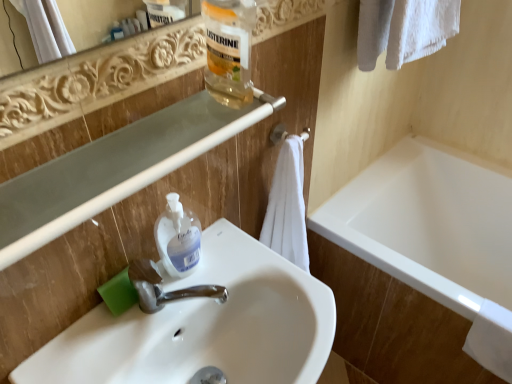
What is the approximate width of translucent plastic hand soap at sink?

translucent plastic hand soap at sink is 2.25 inches wide.

In order to face white soft towel at center, should I rotate leftwards or rightwards?

A 5.108 degree turn to the right will do.

The width and height of the screenshot is (512, 384). What do you see at coordinates (287, 206) in the screenshot?
I see `white soft towel at center` at bounding box center [287, 206].

The width and height of the screenshot is (512, 384). I want to click on clear plastic balustrade at upper center, so click(115, 169).

I want to click on translucent plastic hand soap at sink, so click(x=178, y=238).

Is clear plastic balustrade at upper center shorter than translucent plastic hand soap at sink?

Yes.

Which object is closer to the camera, clear plastic balustrade at upper center or translucent plastic hand soap at sink?

clear plastic balustrade at upper center is more forward.

Which point is more distant from viewer, (145, 157) or (186, 214)?

Point (186, 214)

Is clear plastic balustrade at upper center not within translucent plastic hand soap at sink?

Yes, clear plastic balustrade at upper center is not within translucent plastic hand soap at sink.

From a real-world perspective, which is physically below, white glossy bathtub at lower right or white soft towel at center?

white glossy bathtub at lower right is physically lower.

From the picture: Considering the relative positions of white glossy bathtub at lower right and white soft towel at center in the image provided, is white glossy bathtub at lower right to the left or to the right of white soft towel at center?

In the image, white glossy bathtub at lower right appears on the right side of white soft towel at center.

Who is smaller, white glossy bathtub at lower right or white soft towel at center?

Smaller between the two is white soft towel at center.

Considering the sizes of objects white glossy bathtub at lower right and white soft towel at center in the image provided, who is wider, white glossy bathtub at lower right or white soft towel at center?

white glossy bathtub at lower right.

From the image's perspective, is white soft towel at center below white glossy sink at center?

Actually, white soft towel at center appears above white glossy sink at center in the image.

Between white soft towel at center and white glossy sink at center, which one appears on the right side from the viewer's perspective?

white soft towel at center is more to the right.

Is white soft towel at center beside white glossy sink at center?

No, white soft towel at center is not touching white glossy sink at center.

Does point (168, 262) come behind point (236, 74)?

Yes, it is.

Consider the image. Is translucent plastic hand soap at sink in contact with translucent plastic bottle at upper center?

No, translucent plastic hand soap at sink is not beside translucent plastic bottle at upper center.

Is translucent plastic hand soap at sink smaller than translucent plastic bottle at upper center?

Correct, translucent plastic hand soap at sink occupies less space than translucent plastic bottle at upper center.

You are a GUI agent. You are given a task and a screenshot of the screen. Output one action in this format:
    pyautogui.click(x=<x>, y=<y>)
    Task: Click on the bottle located in front of the translucent plastic hand soap at sink
    The height and width of the screenshot is (384, 512).
    Given the screenshot: What is the action you would take?
    pyautogui.click(x=229, y=50)

Looking at this image, what's the angular difference between white glossy sink at center and translucent plastic bottle at upper center's facing directions?

They differ by 90.4 degrees in their facing directions.

Considering the sizes of white glossy sink at center and translucent plastic bottle at upper center in the image, is white glossy sink at center wider or thinner than translucent plastic bottle at upper center?

In the image, white glossy sink at center appears to be wider than translucent plastic bottle at upper center.

From a real-world perspective, between white glossy sink at center and translucent plastic bottle at upper center, who is vertically higher?

translucent plastic bottle at upper center.

Are white glossy sink at center and translucent plastic bottle at upper center located far from each other?

white glossy sink at center is near translucent plastic bottle at upper center, not far away.

Consider the image. Is clear plastic balustrade at upper center inside translucent plastic bottle at upper center?

That's incorrect, clear plastic balustrade at upper center is not inside translucent plastic bottle at upper center.

Between translucent plastic bottle at upper center and clear plastic balustrade at upper center, which one appears on the left side from the viewer's perspective?

From the viewer's perspective, clear plastic balustrade at upper center appears more on the left side.

From their relative heights in the image, would you say translucent plastic bottle at upper center is taller or shorter than clear plastic balustrade at upper center?

translucent plastic bottle at upper center is taller than clear plastic balustrade at upper center.

Measure the distance between translucent plastic bottle at upper center and clear plastic balustrade at upper center.

The distance of translucent plastic bottle at upper center from clear plastic balustrade at upper center is 6.16 inches.

Between white glossy sink at center and white glossy bathtub at lower right, which one appears on the left side from the viewer's perspective?

From the viewer's perspective, white glossy sink at center appears more on the left side.

Which of these two, white glossy sink at center or white glossy bathtub at lower right, stands taller?

Standing taller between the two is white glossy bathtub at lower right.

Would you say white glossy bathtub at lower right is part of white glossy sink at center's contents?

That's incorrect, white glossy bathtub at lower right is not inside white glossy sink at center.

Where is `cleaning product below the clear plastic balustrade at upper center (from the image's perspective)`? The image size is (512, 384). cleaning product below the clear plastic balustrade at upper center (from the image's perspective) is located at coordinates (178, 238).

Find the location of `bathtub that is on the right side of white soft towel at center`. bathtub that is on the right side of white soft towel at center is located at coordinates (435, 235).

Based on their spatial positions, is white glossy bathtub at lower right or white matte towel bar at center closer to translucent plastic bottle at upper center?

Based on the image, white matte towel bar at center appears to be nearer to translucent plastic bottle at upper center.

Looking at the image, which one is located further to translucent plastic bottle at upper center, white glossy bathtub at lower right or white glossy sink at center?

white glossy bathtub at lower right is positioned further to the anchor translucent plastic bottle at upper center.

Which object lies nearer to the anchor point white matte towel bar at center, white glossy bathtub at lower right or translucent plastic hand soap at sink?

translucent plastic hand soap at sink lies closer to white matte towel bar at center than the other object.

Considering their positions, is white matte towel bar at center positioned closer to translucent plastic hand soap at sink than translucent plastic bottle at upper center?

Answer: translucent plastic bottle at upper center.

When comparing their distances from clear plastic balustrade at upper center, does white glossy sink at center or white matte towel bar at center seem further?

white matte towel bar at center is further to clear plastic balustrade at upper center.

When comparing their distances from white glossy sink at center, does white glossy bathtub at lower right or translucent plastic hand soap at sink seem further?

Among the two, white glossy bathtub at lower right is located further to white glossy sink at center.

Estimate the real-world distances between objects in this image. Which object is closer to white glossy bathtub at lower right, clear plastic balustrade at upper center or white matte towel bar at center?

white matte towel bar at center is positioned closer to the anchor white glossy bathtub at lower right.

Looking at the image, which one is located closer to translucent plastic hand soap at sink, white matte towel bar at center or white glossy bathtub at lower right?

white matte towel bar at center is closer to translucent plastic hand soap at sink.

This screenshot has width=512, height=384. Find the location of `bottle situated between translucent plastic hand soap at sink and white glossy bathtub at lower right from left to right`. bottle situated between translucent plastic hand soap at sink and white glossy bathtub at lower right from left to right is located at coordinates click(229, 50).

Where is `cleaning product positioned between clear plastic balustrade at upper center and white soft towel at center from near to far`? The height and width of the screenshot is (384, 512). cleaning product positioned between clear plastic balustrade at upper center and white soft towel at center from near to far is located at coordinates (178, 238).

Where is `balustrade between translucent plastic bottle at upper center and translucent plastic hand soap at sink in the vertical direction`? The height and width of the screenshot is (384, 512). balustrade between translucent plastic bottle at upper center and translucent plastic hand soap at sink in the vertical direction is located at coordinates (115, 169).

Identify the location of bath towel located between white glossy sink at center and white glossy bathtub at lower right in the left-right direction. (287, 206).